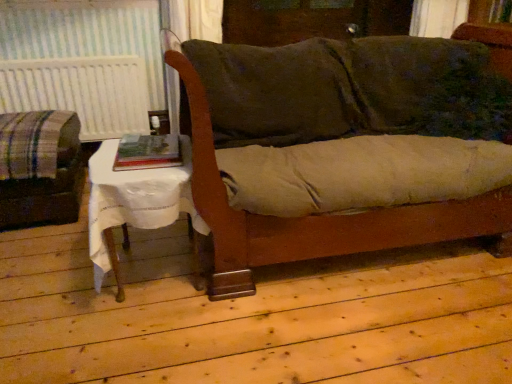
I want to click on vacant region below hardcover book at center (from a real-world perspective), so click(143, 159).